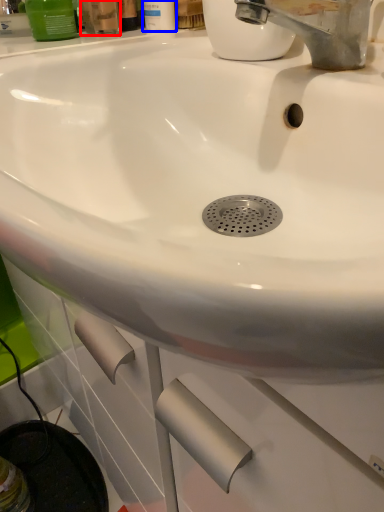
Question: Which point is closer to the camera, mouthwash (highlighted by a red box) or mouthwash (highlighted by a blue box)?

Choices:
 (A) mouthwash
 (B) mouthwash

Answer: (A)